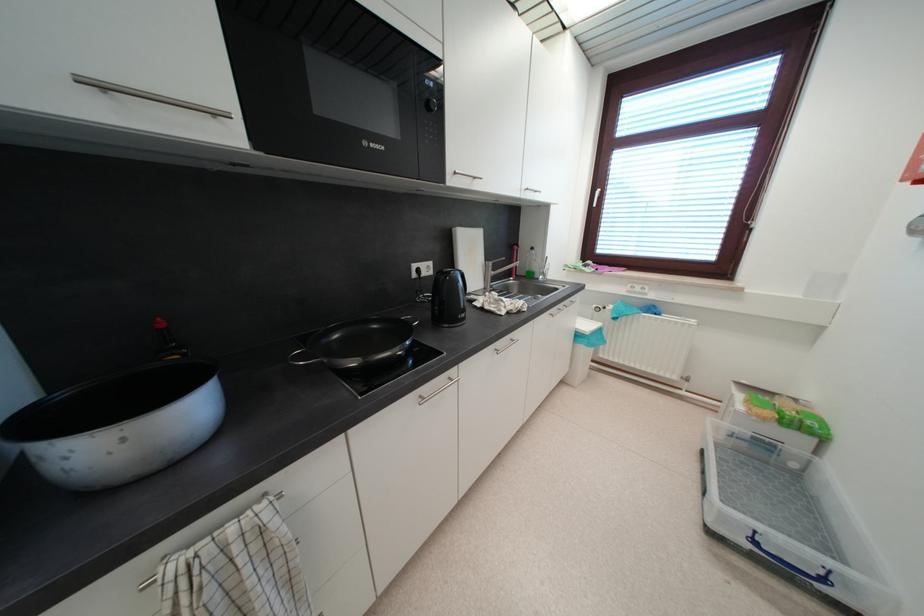
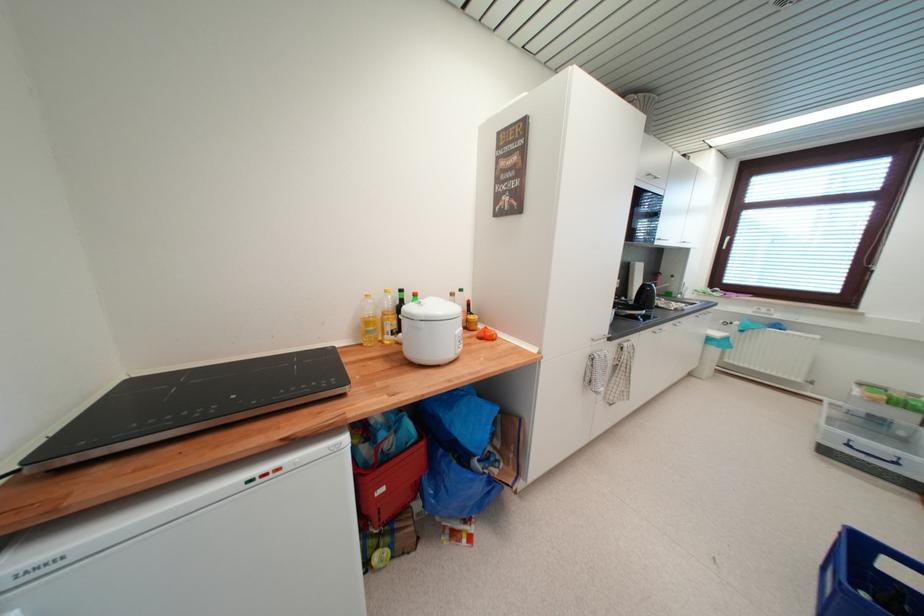
Question: I am providing you with two images of the same scene from different viewpoints. Which of the following objects are not visible in image2?

Choices:
 (A) red storage box
 (B) dark green bottle
 (C) bar of soap
 (D) microwave dial

Answer: (D)